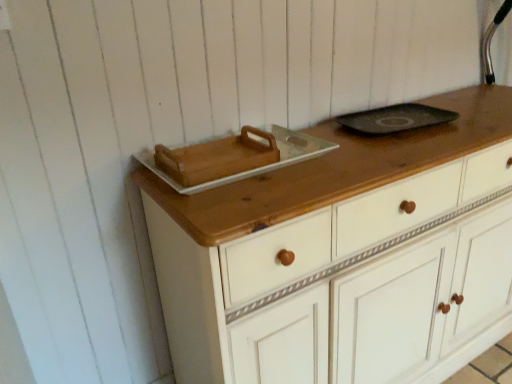
Question: Does wooden tray at upper center appear on the left side of white painted wood chest of drawers at center?

Choices:
 (A) yes
 (B) no

Answer: (A)

Question: Does wooden tray at upper center have a greater width compared to white painted wood chest of drawers at center?

Choices:
 (A) no
 (B) yes

Answer: (A)

Question: Would you say wooden tray at upper center contains white painted wood chest of drawers at center?

Choices:
 (A) no
 (B) yes

Answer: (A)

Question: Is wooden tray at upper center thinner than white painted wood chest of drawers at center?

Choices:
 (A) yes
 (B) no

Answer: (A)

Question: Is wooden tray at upper center outside of white painted wood chest of drawers at center?

Choices:
 (A) no
 (B) yes

Answer: (B)

Question: Is wooden tray at upper center positioned in front of white painted wood chest of drawers at center?

Choices:
 (A) yes
 (B) no

Answer: (B)

Question: Is white painted wood chest of drawers at center to the left of wooden tray at upper center from the viewer's perspective?

Choices:
 (A) yes
 (B) no

Answer: (B)

Question: Can wooden tray at upper center be found inside white painted wood chest of drawers at center?

Choices:
 (A) no
 (B) yes

Answer: (A)

Question: Is there a large distance between white painted wood chest of drawers at center and wooden tray at upper center?

Choices:
 (A) yes
 (B) no

Answer: (B)

Question: Is white painted wood chest of drawers at center turned away from wooden tray at upper center?

Choices:
 (A) no
 (B) yes

Answer: (A)

Question: Can you confirm if white painted wood chest of drawers at center is bigger than wooden tray at upper center?

Choices:
 (A) no
 (B) yes

Answer: (B)

Question: Is white painted wood chest of drawers at center wider than wooden tray at upper center?

Choices:
 (A) no
 (B) yes

Answer: (B)

Question: Is point (335, 286) closer or farther from the camera than point (159, 173)?

Choices:
 (A) farther
 (B) closer

Answer: (A)